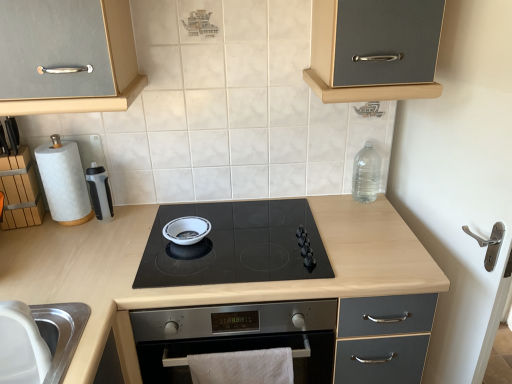
Where is `empty space that is to the right of white paper towel at left`? The width and height of the screenshot is (512, 384). empty space that is to the right of white paper towel at left is located at coordinates (120, 229).